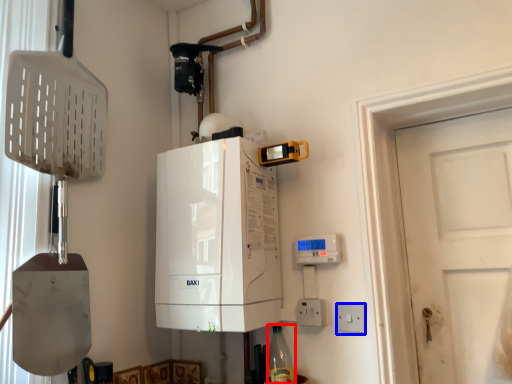
Question: Which object is closer to the camera taking this photo, bottle (highlighted by a red box) or electric outlet (highlighted by a blue box)?

Choices:
 (A) bottle
 (B) electric outlet

Answer: (B)